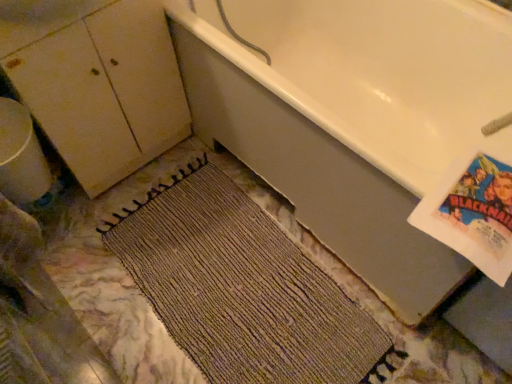
Question: From a real-world perspective, is white glossy bathtub at upper right positioned over white glossy cabinet at upper left based on gravity?

Choices:
 (A) yes
 (B) no

Answer: (B)

Question: From a real-world perspective, is white glossy bathtub at upper right under white glossy cabinet at upper left?

Choices:
 (A) yes
 (B) no

Answer: (A)

Question: Could you tell me if white glossy bathtub at upper right is turned towards white glossy cabinet at upper left?

Choices:
 (A) yes
 (B) no

Answer: (B)

Question: Is white glossy bathtub at upper right not within white glossy cabinet at upper left?

Choices:
 (A) no
 (B) yes

Answer: (B)

Question: Does white glossy bathtub at upper right have a smaller size compared to white glossy cabinet at upper left?

Choices:
 (A) no
 (B) yes

Answer: (A)

Question: From a real-world perspective, is white glossy cabinet at upper left above or below matte white cabinet at left?

Choices:
 (A) below
 (B) above

Answer: (B)

Question: In the image, is white glossy cabinet at upper left on the left side or the right side of matte white cabinet at left?

Choices:
 (A) right
 (B) left

Answer: (B)

Question: From the image's perspective, is white glossy cabinet at upper left positioned above or below matte white cabinet at left?

Choices:
 (A) above
 (B) below

Answer: (A)

Question: Is point (56, 6) closer or farther from the camera than point (118, 79)?

Choices:
 (A) closer
 (B) farther

Answer: (A)

Question: In terms of width, does matte white cabinet at left look wider or thinner when compared to white glossy bathtub at upper right?

Choices:
 (A) wide
 (B) thin

Answer: (B)

Question: From the image's perspective, relative to white glossy bathtub at upper right, is matte white cabinet at left above or below?

Choices:
 (A) below
 (B) above

Answer: (B)

Question: Do you think matte white cabinet at left is within white glossy bathtub at upper right, or outside of it?

Choices:
 (A) outside
 (B) inside

Answer: (A)

Question: Would you say matte white cabinet at left is to the left or to the right of white glossy bathtub at upper right in the picture?

Choices:
 (A) right
 (B) left

Answer: (B)

Question: Is point (34, 26) positioned closer to the camera than point (328, 67)?

Choices:
 (A) closer
 (B) farther

Answer: (A)

Question: In terms of height, does white glossy cabinet at upper left look taller or shorter compared to white glossy bathtub at upper right?

Choices:
 (A) tall
 (B) short

Answer: (B)